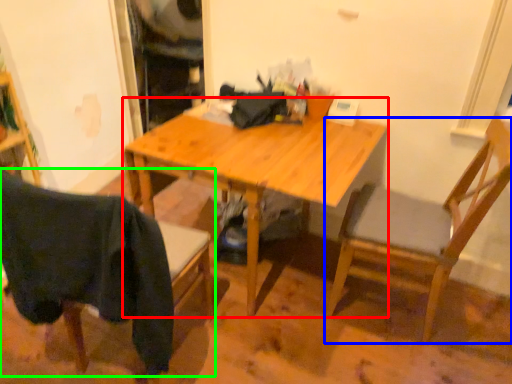
Question: Which object is the farthest from desk (highlighted by a red box)? Choose among these: chair (highlighted by a blue box) or chair (highlighted by a green box).

Choices:
 (A) chair
 (B) chair

Answer: (B)